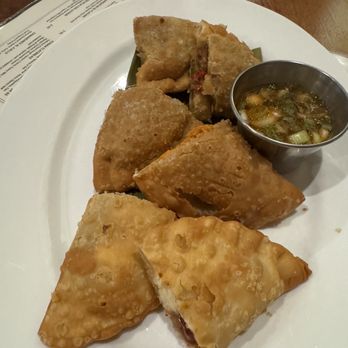
You are a GUI agent. You are given a task and a screenshot of the screen. Output one action in this format:
    pyautogui.click(x=<x>, y=<y>)
    Task: Click on the white dinner plate
    The width and height of the screenshot is (348, 348).
    Given the screenshot: What is the action you would take?
    pyautogui.click(x=319, y=298)